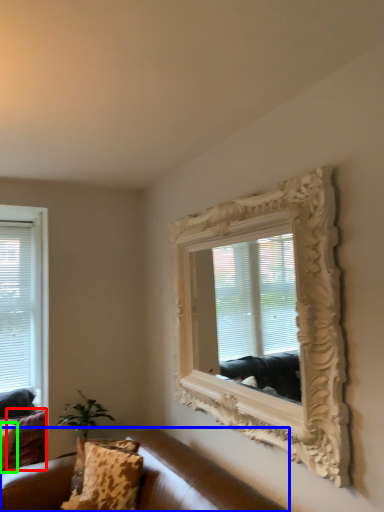
Question: Based on their relative distances, which object is farther from pillow (highlighted by a red box)? Choose from studio couch (highlighted by a blue box) and pillow (highlighted by a green box).

Choices:
 (A) studio couch
 (B) pillow

Answer: (A)